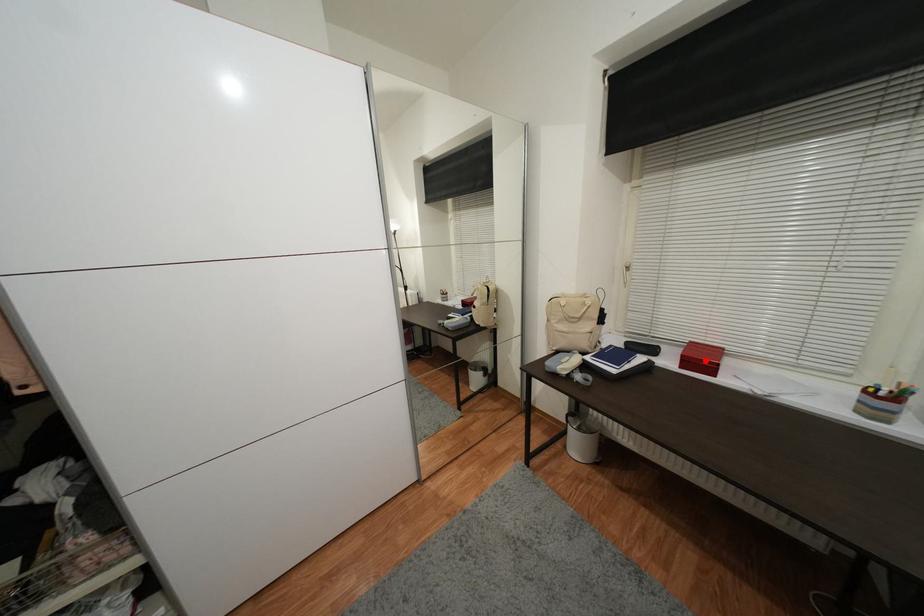
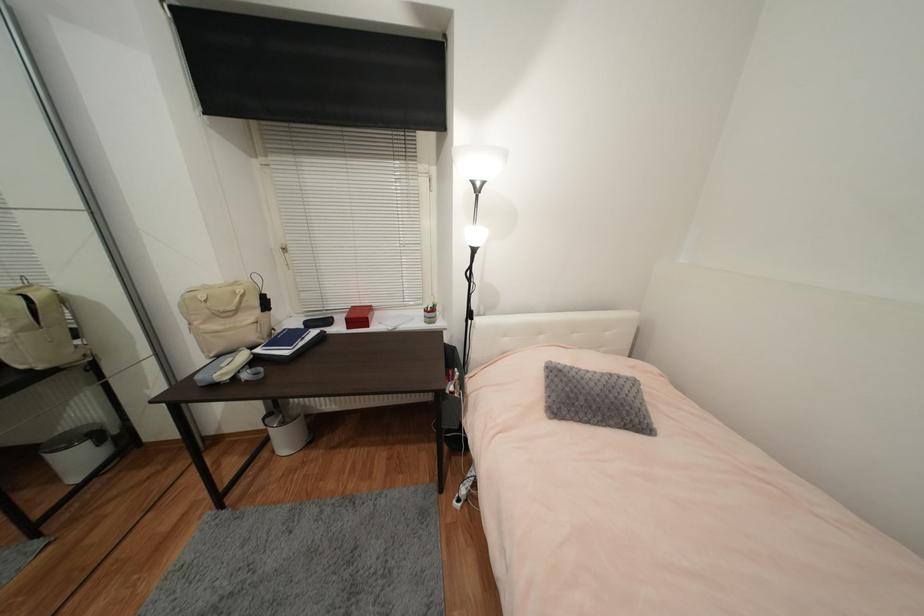
Question: I am providing you with two images of the same scene from different viewpoints. A red point is marked on the first image. Is the red point's position out of view in image 2?

Choices:
 (A) Yes
 (B) No

Answer: (B)